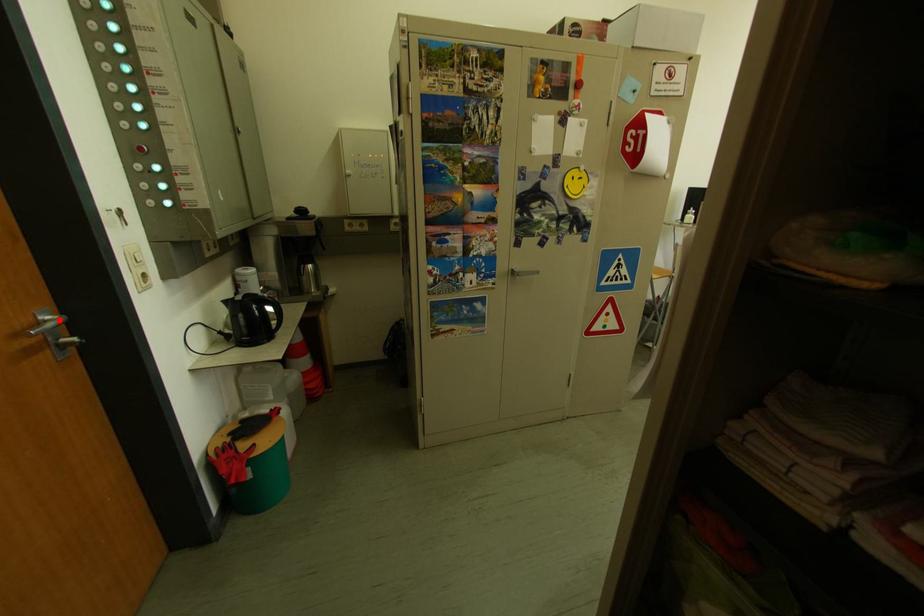
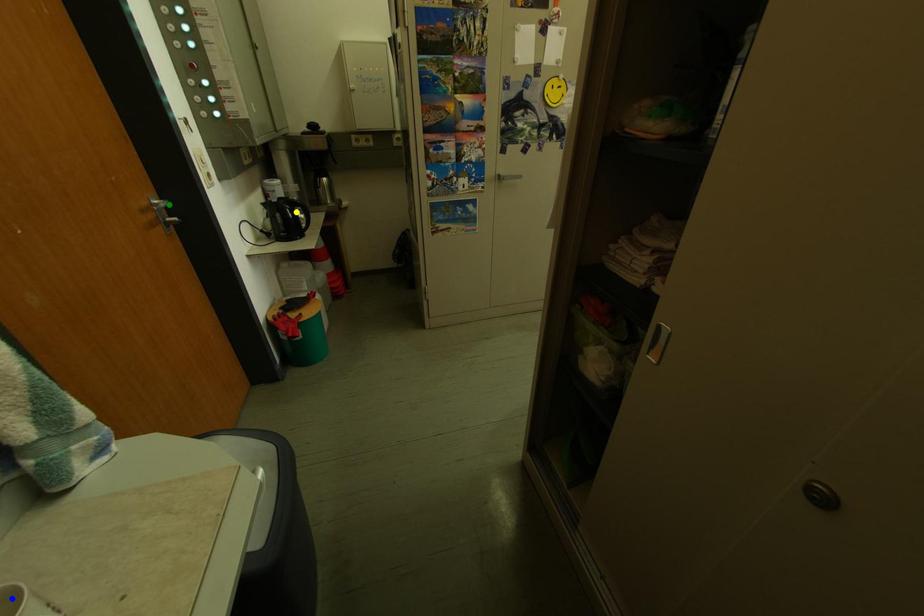
Question: I am providing you with two images of the same scene from different viewpoints. A red point is marked on the first image. You are given multiple points on the second image. Which mark in image 2 goes with the point in image 1?

Choices:
 (A) blue point
 (B) green point
 (C) yellow point

Answer: (B)